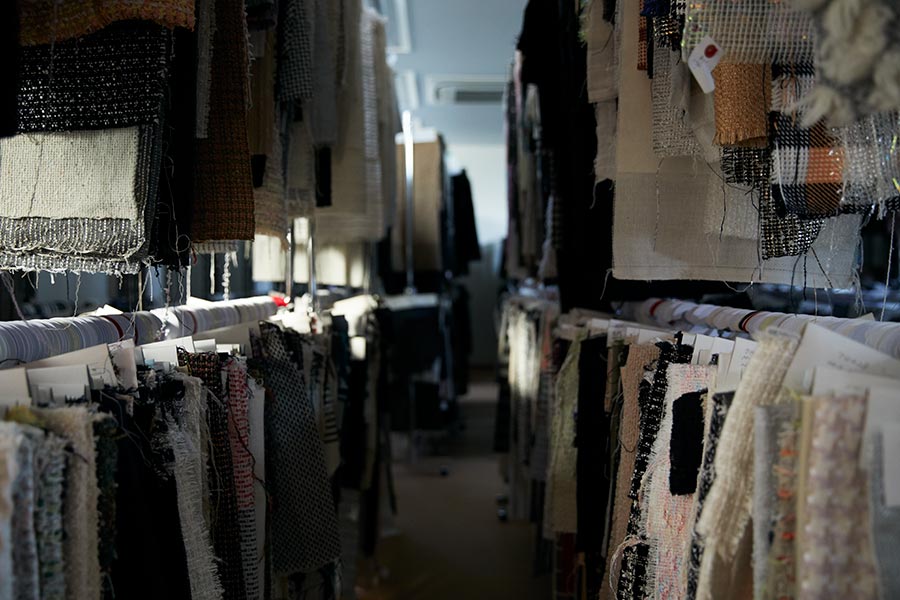
The height and width of the screenshot is (600, 900). In order to click on vent on top in this screenshot , I will do `click(487, 94)`.